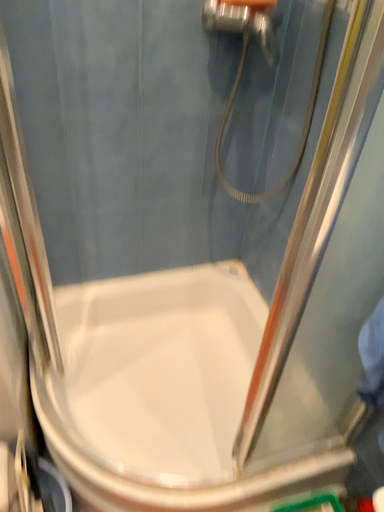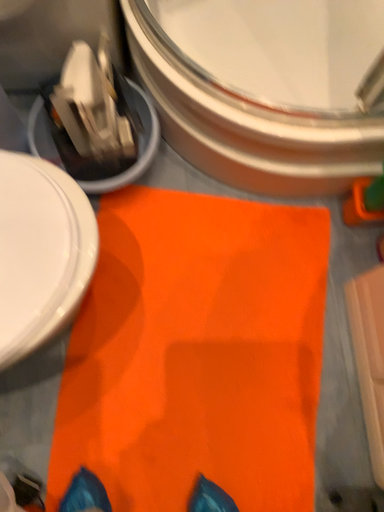
Question: Which way did the camera rotate in the video?

Choices:
 (A) rotated downward
 (B) rotated upward

Answer: (A)